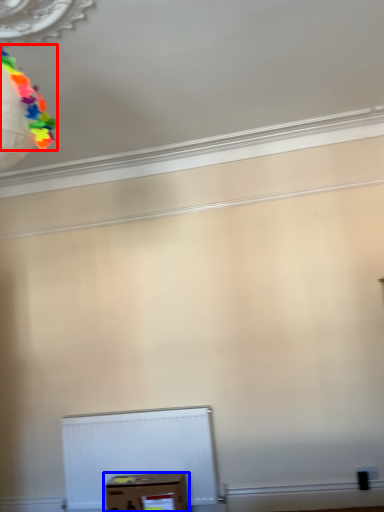
Question: Among these objects, which one is farthest to the camera, balloon (highlighted by a red box) or box (highlighted by a blue box)?

Choices:
 (A) balloon
 (B) box

Answer: (B)